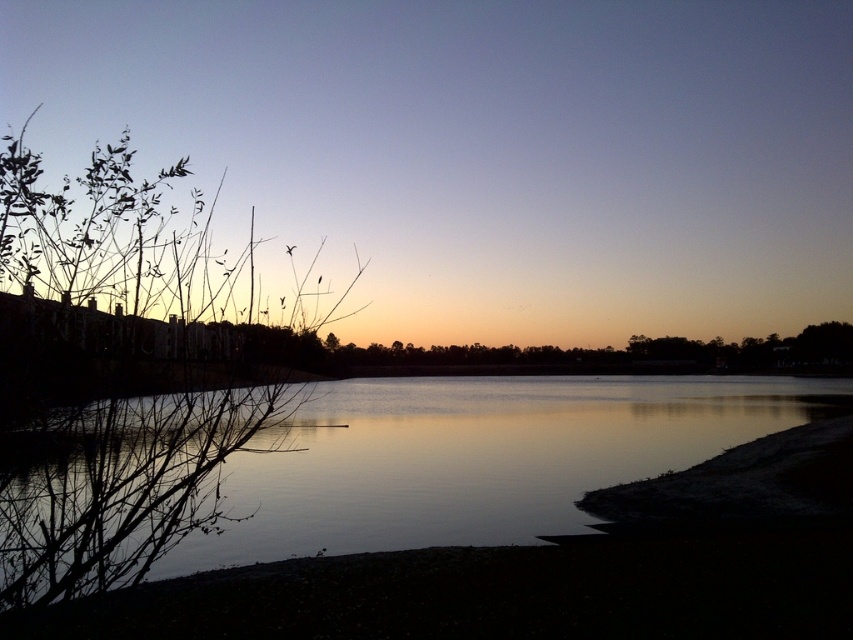
You are an artist trying to paint the scene. You notice the green leafy branches at left and the silvery reflective water at center. Which object should you paint first if you follow the rule of painting taller objects before shorter ones?

The green leafy branches at left should be painted first because they are taller than the silvery reflective water at center according to the description.

You are an artist trying to sketch this lakeside scene. You want to ensure the green leafy branches at left and the silvery reflective water at center are proportionally accurate. Which object should you draw with a narrower width?

The green leafy branches at left should be drawn with a narrower width since it is thinner than the silvery reflective water at center according to the description.

You are standing at the center of the lakeside scene and notice the green leafy branches at left. Based on their position, can you determine if they are closer to you or further away compared to the silhouettes of trees and buildings in the middle distance?

The green leafy branches at left are located at point (x=125, y=378), which places them closer to the viewer than the silhouettes of trees and buildings in the middle distance.